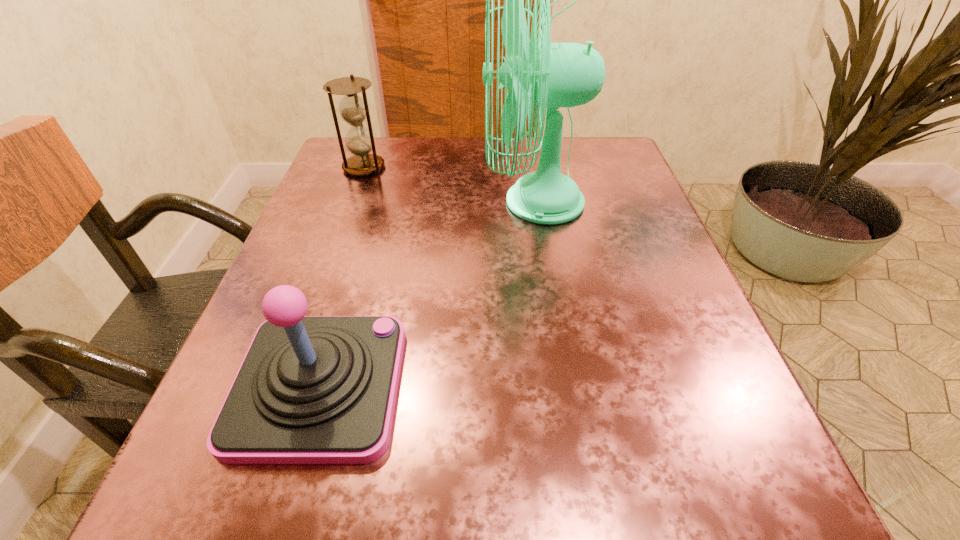
You are a GUI agent. You are given a task and a screenshot of the screen. Output one action in this format:
    pyautogui.click(x=<x>, y=<y>)
    Task: Click on the fan
    This screenshot has height=540, width=960.
    Given the screenshot: What is the action you would take?
    pyautogui.click(x=551, y=75)

In order to click on the rightmost object in this screenshot , I will do `click(551, 75)`.

Identify the location of hourglass. (354, 110).

In order to click on the nearest object in this screenshot , I will do `click(311, 389)`.

Where is `vacant space located in front of the fan to blow air`? This screenshot has width=960, height=540. vacant space located in front of the fan to blow air is located at coordinates (391, 202).

Find the location of a particular element. The height and width of the screenshot is (540, 960). vacant space located 0.190m in front of the fan to blow air is located at coordinates (391, 202).

Find the location of a particular element. Image resolution: width=960 pixels, height=540 pixels. vacant region located 0.130m in front of the fan to blow air is located at coordinates (420, 202).

Find the location of a particular element. vacant space located 0.080m on the front of the hourglass is located at coordinates (352, 199).

Find the location of `vacant point located 0.130m forward from the base of the joystick`. vacant point located 0.130m forward from the base of the joystick is located at coordinates (493, 385).

Locate an element on the screen. The height and width of the screenshot is (540, 960). fan located at the far edge is located at coordinates (551, 75).